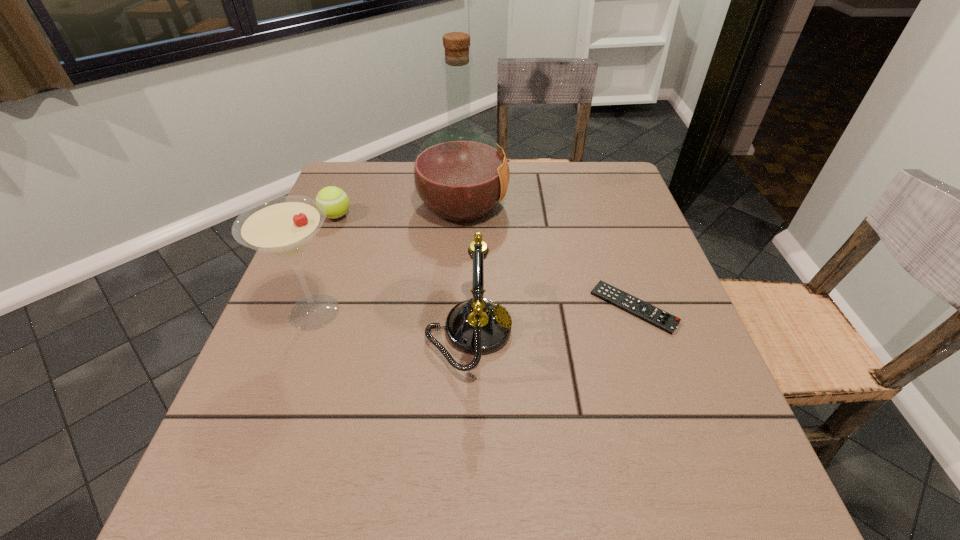
Identify the location of liquor. (460, 174).

Find the location of a particular element. The width and height of the screenshot is (960, 540). martini is located at coordinates (283, 227).

I want to click on telephone, so click(477, 326).

You are a GUI agent. You are given a task and a screenshot of the screen. Output one action in this format:
    pyautogui.click(x=<x>, y=<y>)
    Task: Click on the second shortest object
    
    Given the screenshot: What is the action you would take?
    pyautogui.click(x=336, y=202)

The width and height of the screenshot is (960, 540). In order to click on the shortest object in this screenshot , I will do `click(663, 320)`.

Where is `remote control`? The height and width of the screenshot is (540, 960). remote control is located at coordinates (663, 320).

Find the location of a particular element. This screenshot has width=960, height=540. vacant space located on the front label of the tallest object is located at coordinates (580, 206).

Where is `vacant space situated 0.190m on the right of the fourth shortest object`? The width and height of the screenshot is (960, 540). vacant space situated 0.190m on the right of the fourth shortest object is located at coordinates (445, 312).

Locate an element on the screen. This screenshot has width=960, height=540. vacant position located on the dial of the telephone is located at coordinates (625, 332).

This screenshot has height=540, width=960. Find the location of `vacant space located 0.150m on the right of the second shortest object`. vacant space located 0.150m on the right of the second shortest object is located at coordinates (411, 216).